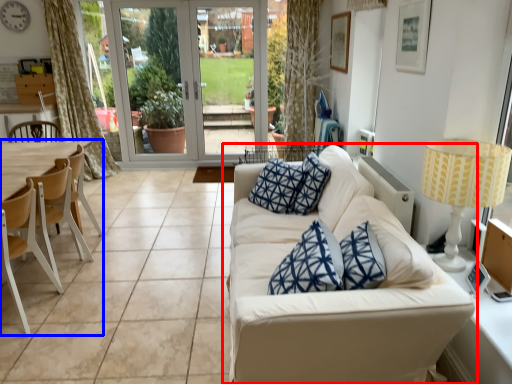
Question: Which object appears farthest to the camera in this image, studio couch (highlighted by a red box) or armchair (highlighted by a blue box)?

Choices:
 (A) studio couch
 (B) armchair

Answer: (B)